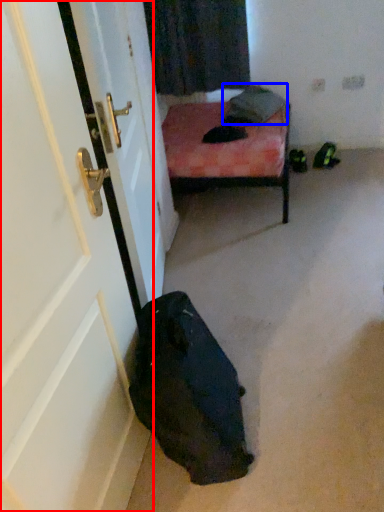
Question: Which point is closer to the camera, door (highlighted by a red box) or pillow (highlighted by a blue box)?

Choices:
 (A) door
 (B) pillow

Answer: (A)